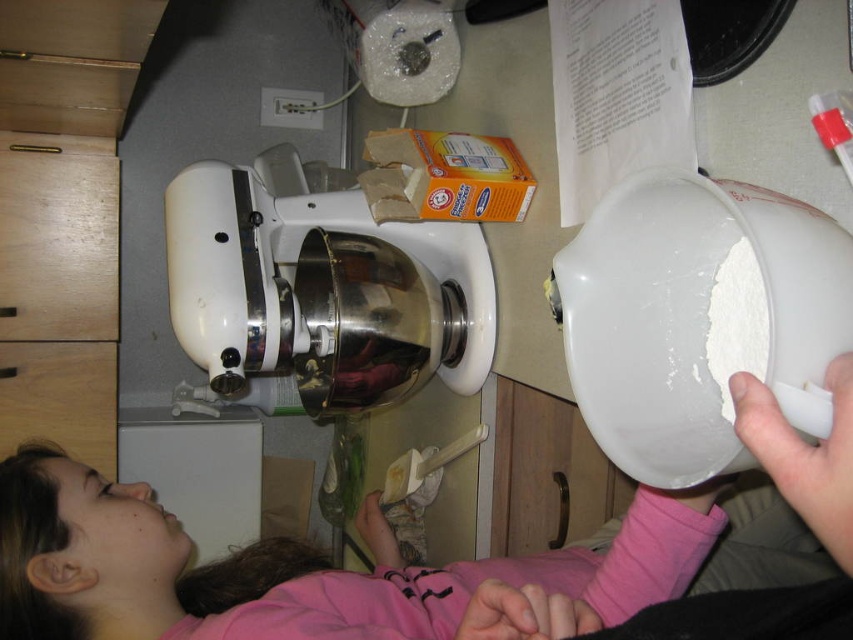
Question: Is white glossy mixer at center to the right of wooden drawer at lower left from the viewer's perspective?

Choices:
 (A) no
 (B) yes

Answer: (B)

Question: Does white glossy mixer at center have a greater width compared to wooden drawer at lower left?

Choices:
 (A) yes
 (B) no

Answer: (A)

Question: Is white glossy mixer at center behind wooden drawer at lower left?

Choices:
 (A) yes
 (B) no

Answer: (B)

Question: Which of the following is the farthest from the observer?

Choices:
 (A) (115, 424)
 (B) (212, 337)

Answer: (A)

Question: Which point is farther to the camera?

Choices:
 (A) wooden drawer at lower left
 (B) wooden at left
 (C) white glossy mixer at center

Answer: (A)

Question: Which object is the closest to the wooden drawer at lower left?

Choices:
 (A) white glossy mixer at center
 (B) wooden at left

Answer: (B)